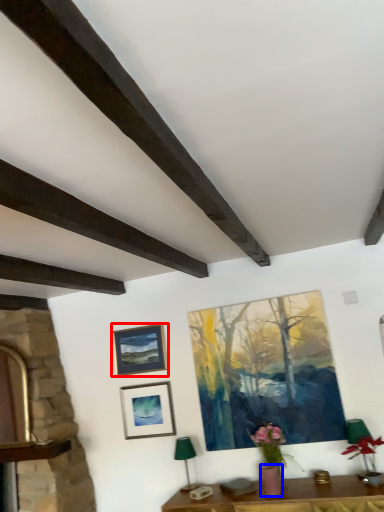
Question: Which of the following is the farthest to the observer, picture frame (highlighted by a red box) or flowerpot (highlighted by a blue box)?

Choices:
 (A) picture frame
 (B) flowerpot

Answer: (A)